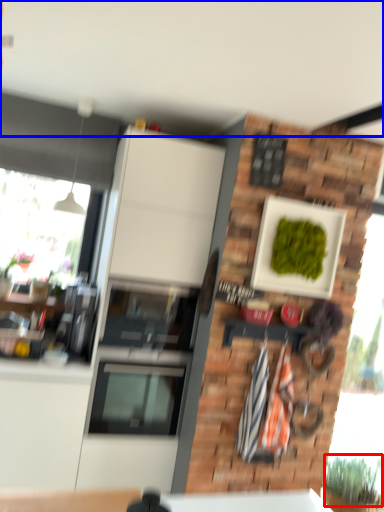
Question: Which of the following is the closest to the observer, plant (highlighted by a red box) or backdrop (highlighted by a blue box)?

Choices:
 (A) plant
 (B) backdrop

Answer: (B)